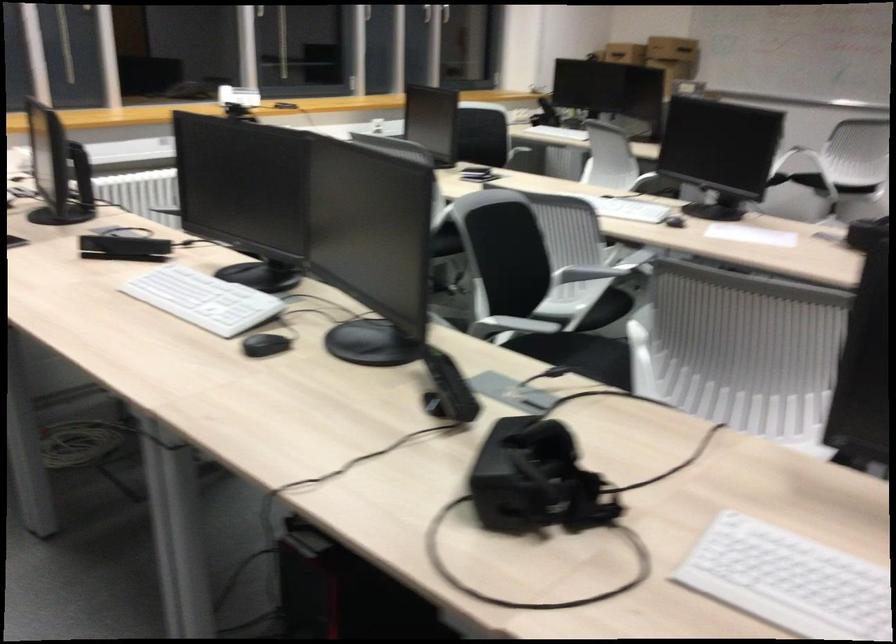
Where would you lift the white webcam? Please return your answer as a coordinate pair (x, y).

(238, 96)